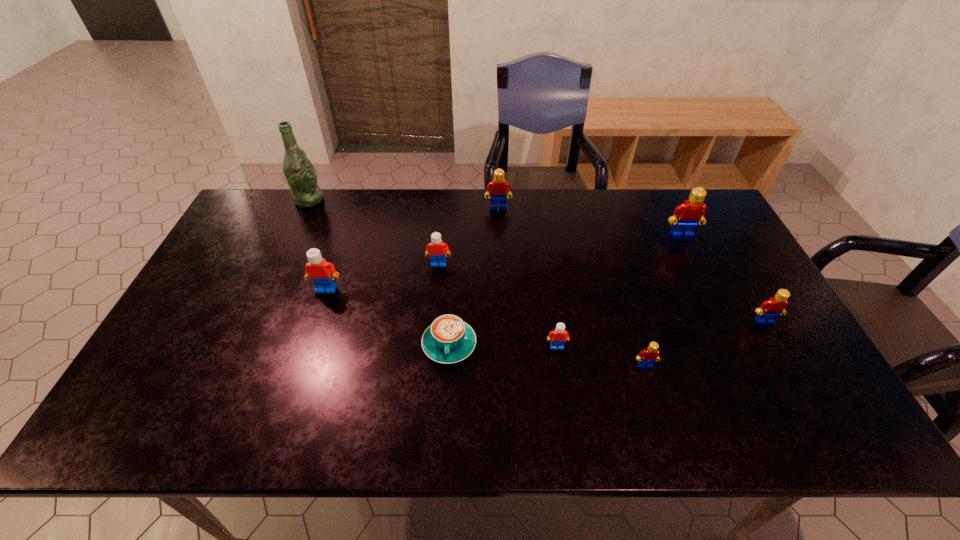
The image size is (960, 540). I want to click on the closest red Lego to the fourth farthest object, so click(x=497, y=187).

Locate an element on the screen. red Lego that is the second closest one to the leftmost Lego is located at coordinates (651, 354).

Select which white Lego is the third closest to the rightmost red Lego. Please provide its 2D coordinates. Your answer should be formatted as a tuple, i.e. [(x, y)], where the tuple contains the x and y coordinates of a point satisfying the conditions above.

[(322, 273)]

The width and height of the screenshot is (960, 540). I want to click on white Lego that is the second closest to the second white Lego from right to left, so click(559, 335).